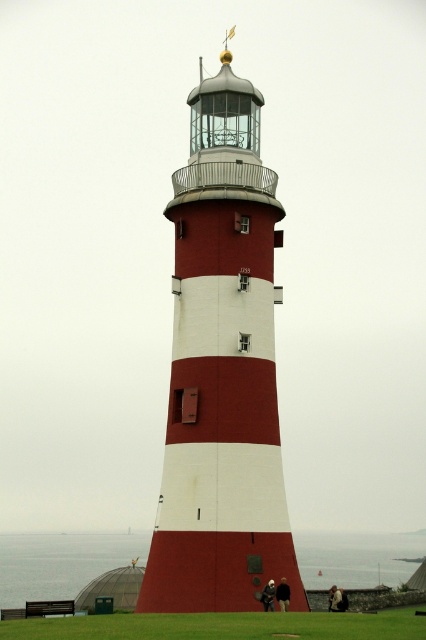
Between point (8, 547) and point (383, 627), which one is positioned in front?

Point (383, 627) is more forward.

Is point (48, 556) positioned before point (192, 637)?

No, (48, 556) is further to viewer.

Image resolution: width=426 pixels, height=640 pixels. What are the coordinates of `transparent water at lower center` in the screenshot? It's located at (60, 563).

Is smooth painted lighthouse at center smaller than green grass at lower center?

Yes.

Is smooth painted lighthouse at center bigger than green grass at lower center?

Actually, smooth painted lighthouse at center might be smaller than green grass at lower center.

This screenshot has width=426, height=640. What are the coordinates of `smooth painted lighthouse at center` in the screenshot? It's located at pos(221,371).

Who is higher up, smooth painted lighthouse at center or transparent water at lower center?

smooth painted lighthouse at center is above.

Between smooth painted lighthouse at center and transparent water at lower center, which one has less height?

With less height is transparent water at lower center.

Is point (227, 368) less distant than point (80, 547)?

Yes, it is.

The height and width of the screenshot is (640, 426). What are the coordinates of `smooth painted lighthouse at center` in the screenshot? It's located at (221, 371).